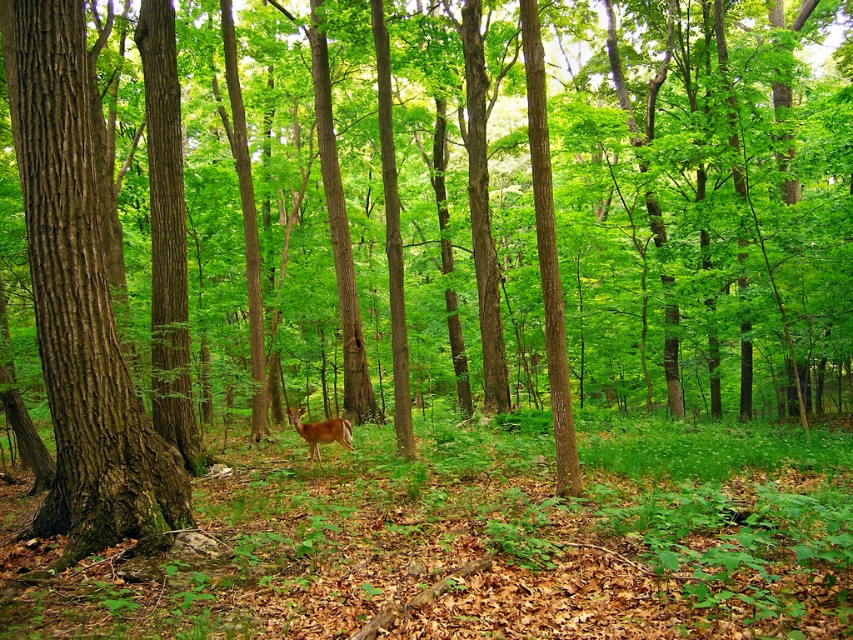
Question: Is brown textured bark at left wider than brown fur deer at center?

Choices:
 (A) yes
 (B) no

Answer: (B)

Question: Which of the following is the farthest from the observer?

Choices:
 (A) (347, 442)
 (B) (18, 160)

Answer: (A)

Question: Can you confirm if brown textured bark at left is smaller than brown fur deer at center?

Choices:
 (A) yes
 (B) no

Answer: (A)

Question: Does brown textured bark at left have a larger size compared to brown fur deer at center?

Choices:
 (A) yes
 (B) no

Answer: (B)

Question: Among these points, which one is farthest from the camera?

Choices:
 (A) (309, 456)
 (B) (49, 90)

Answer: (A)